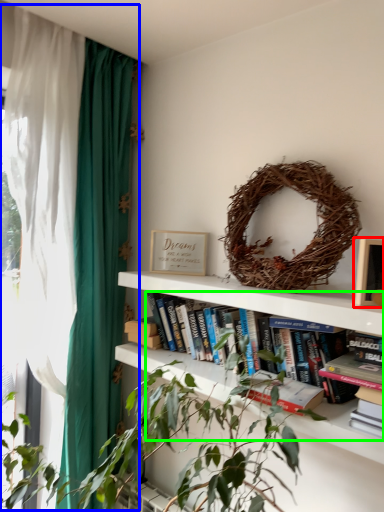
Question: Estimate the real-world distances between objects in this image. Which object is farther from picture frame (highlighted by a red box), curtain (highlighted by a blue box) or book (highlighted by a green box)?

Choices:
 (A) curtain
 (B) book

Answer: (A)